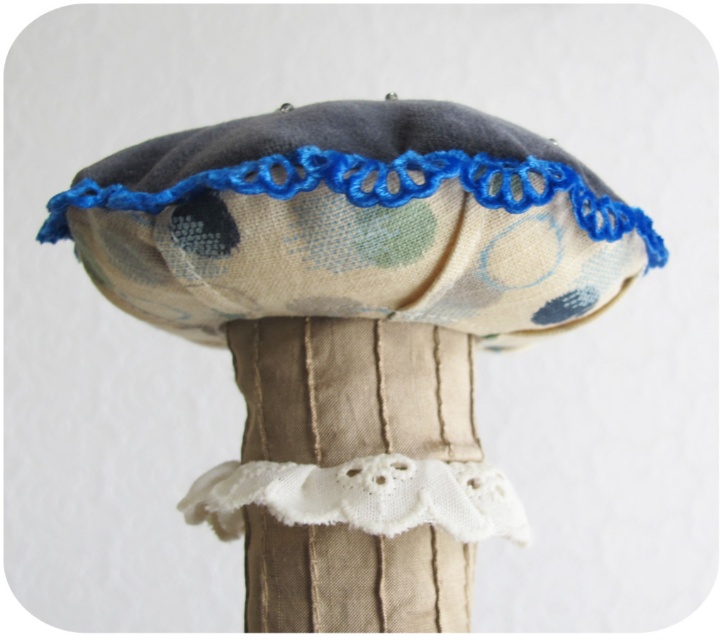
Does point (212, 218) lie in front of point (473, 484)?

That is True.

Is floral fabric hat at center further to the viewer compared to white lace trim at center?

No, it is not.

Does point (102, 205) come closer to viewer compared to point (298, 520)?

Yes.

This screenshot has width=726, height=640. Find the location of `floral fabric hat at center`. floral fabric hat at center is located at coordinates (354, 328).

Can you confirm if floral fabric hat at upper center is smaller than white textured cloth at center?

No, floral fabric hat at upper center is not smaller than white textured cloth at center.

Between floral fabric hat at upper center and white textured cloth at center, which one appears on the left side from the viewer's perspective?

Result: Positioned to the left is white textured cloth at center.

The image size is (726, 640). Find the location of `floral fabric hat at upper center`. floral fabric hat at upper center is located at coordinates (354, 224).

The image size is (726, 640). What are the coordinates of `floral fabric hat at upper center` in the screenshot? It's located at (354, 224).

Can you confirm if floral fabric hat at center is positioned to the left of white textured cloth at center?

Incorrect, floral fabric hat at center is not on the left side of white textured cloth at center.

Consider the image. Does floral fabric hat at center appear under white textured cloth at center?

Actually, floral fabric hat at center is above white textured cloth at center.

Who is more distant from viewer, [444,388] or [309,618]?

The point [444,388] is behind.

What are the coordinates of `floral fabric hat at center` in the screenshot? It's located at (354, 328).